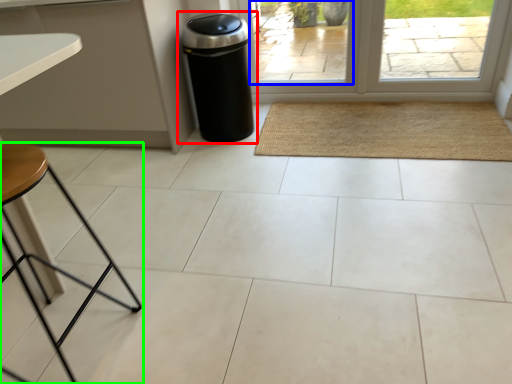
Question: Estimate the real-world distances between objects in this image. Which object is farther from waste container (highlighted by a red box), window (highlighted by a blue box) or furniture (highlighted by a green box)?

Choices:
 (A) window
 (B) furniture

Answer: (B)